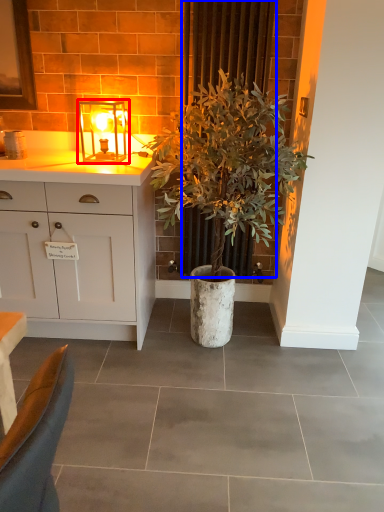
Question: Which point is closer to the camera, lamp (highlighted by a red box) or curtain (highlighted by a blue box)?

Choices:
 (A) lamp
 (B) curtain

Answer: (B)